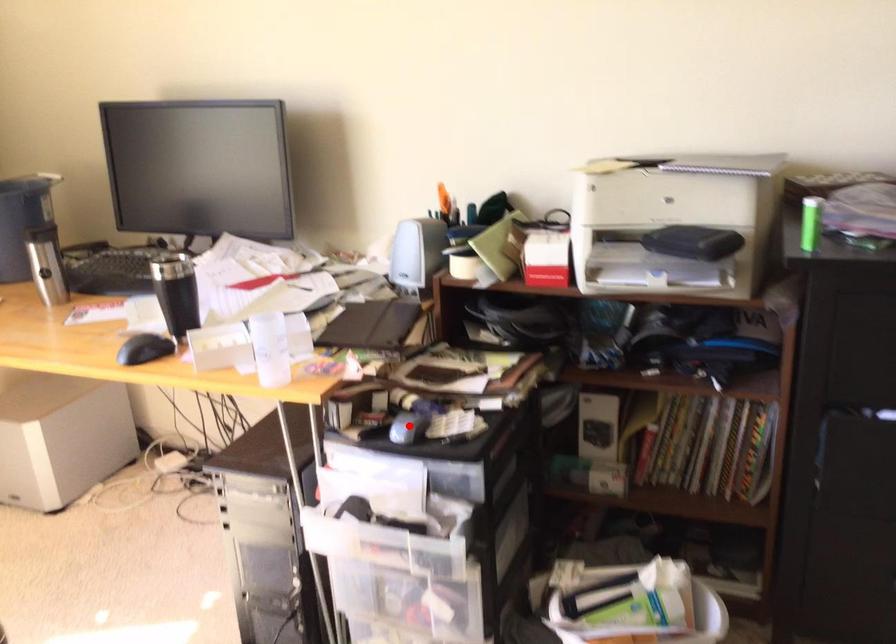
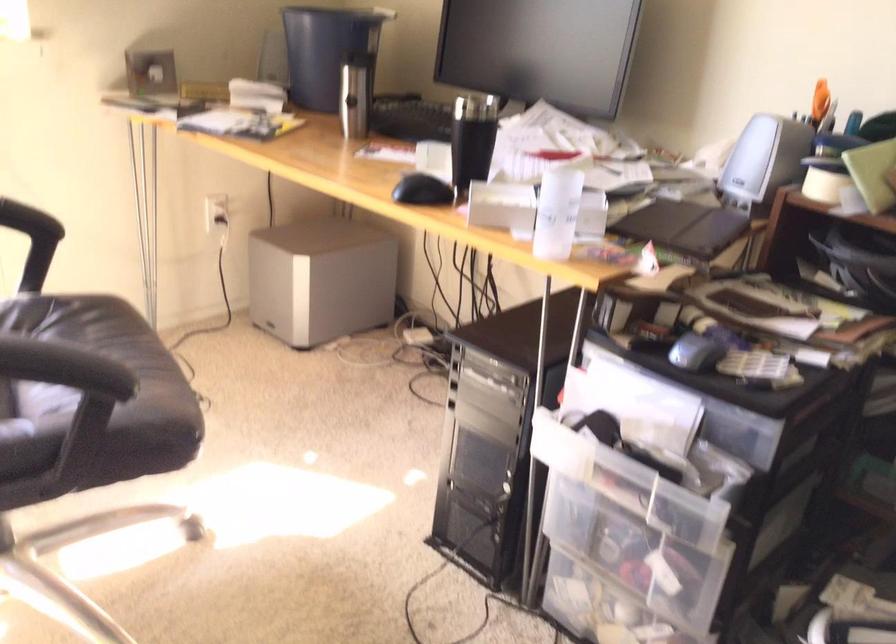
Question: A red point is marked in image1. In image2, is the corresponding 3D point closer to the camera or farther? Reply with the corresponding letter.

Choices:
 (A) The corresponding 3D point is closer.
 (B) The corresponding 3D point is farther.

Answer: (A)